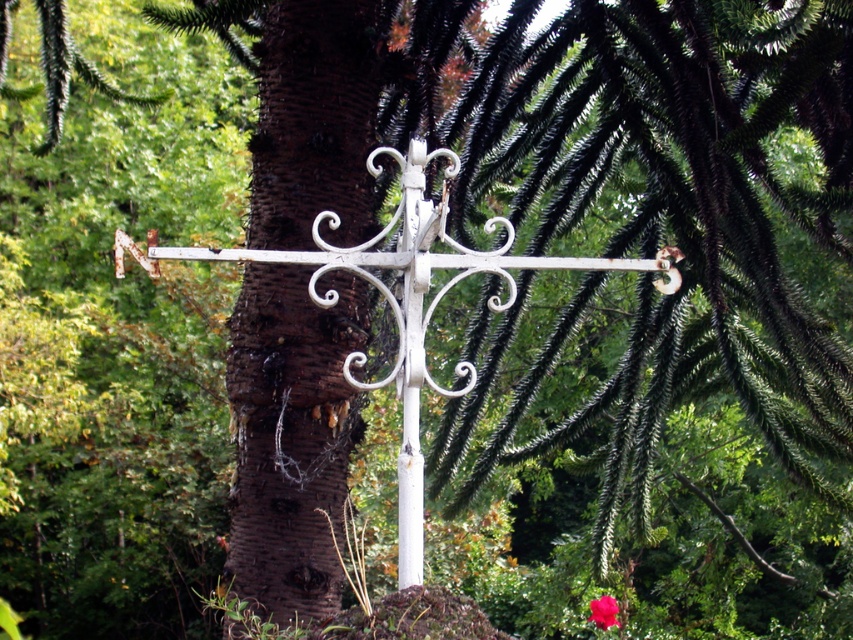
You are an archaeologist examining a historical site. You notice the brown rough bark at center in the image. Can you determine its exact coordinates in the scene?

The brown rough bark at center is located at coordinates point (289, 436).